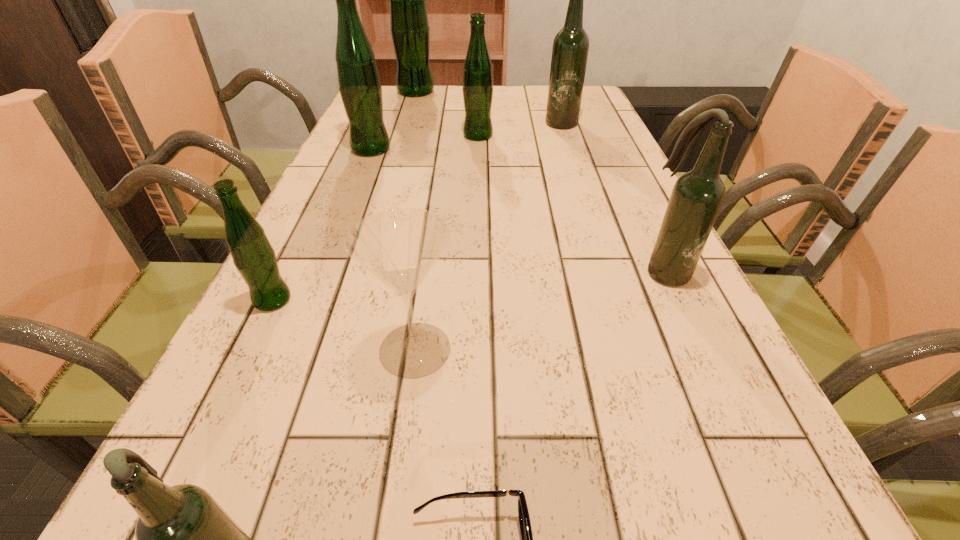
Locate an element on the screen. The width and height of the screenshot is (960, 540). free space at the left edge is located at coordinates tap(311, 310).

Locate an element on the screen. vacant point at the right edge is located at coordinates (717, 434).

Locate an element on the screen. vacant space at the far left corner of the desktop is located at coordinates (410, 98).

You are a GUI agent. You are given a task and a screenshot of the screen. Output one action in this format:
    pyautogui.click(x=<x>, y=<y>)
    Task: Click on the vacant point located between the second biggest green beer bottle and the smallest green beer bottle
    
    Given the screenshot: What is the action you would take?
    pyautogui.click(x=322, y=225)

The width and height of the screenshot is (960, 540). What are the coordinates of `unoccupied position between the third smallest green beer bottle and the biggest green beer bottle` in the screenshot? It's located at point(394,120).

Where is `object that is the sixth nearest to the biggest green beer bottle`? The height and width of the screenshot is (540, 960). object that is the sixth nearest to the biggest green beer bottle is located at coordinates (399, 246).

Identify which object is located as the fourth nearest to the smallest green beer bottle. Please provide its 2D coordinates. Your answer should be formatted as a tuple, i.e. [(x, y)], where the tuple contains the x and y coordinates of a point satisfying the conditions above.

[(360, 88)]

At what (x,y) coordinates should I click in order to perform the action: click on the third closest beer bottle to the sixth beer bottle from left to right. Please return your answer as a coordinate pair (x, y). Looking at the image, I should click on (360, 88).

I want to click on beer bottle object that ranks as the closest to the second biggest dark beer bottle, so click(x=477, y=89).

Identify which green beer bottle is the fourth nearest to the eighth object from left to right. Please provide its 2D coordinates. Your answer should be formatted as a tuple, i.e. [(x, y)], where the tuple contains the x and y coordinates of a point satisfying the conditions above.

[(253, 255)]